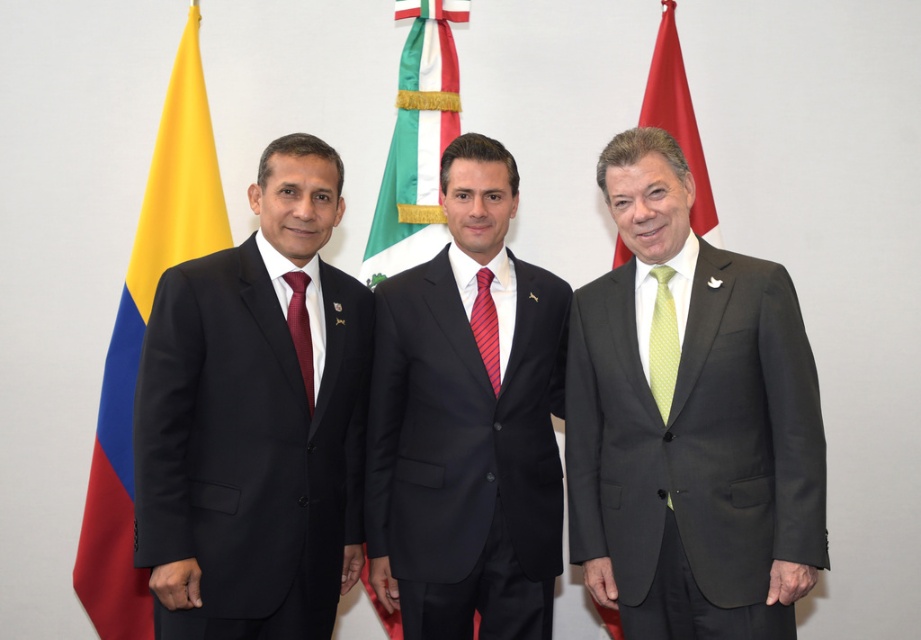
Question: Can you confirm if matte gray suit at right is positioned to the right of black suit at center?

Choices:
 (A) no
 (B) yes

Answer: (B)

Question: Where is matte gray suit at right located in relation to red fabric flag at right in the image?

Choices:
 (A) right
 (B) left

Answer: (B)

Question: Among these objects, which one is nearest to the camera?

Choices:
 (A) black suit at center
 (B) matte black suit at left
 (C) matte red tie at left
 (D) red striped tie at center

Answer: (B)

Question: Can you confirm if red striped tie at center is positioned above matte red tie at left?

Choices:
 (A) no
 (B) yes

Answer: (B)

Question: Which point is closer to the camera taking this photo?

Choices:
 (A) (391, 236)
 (B) (370, 534)
 (C) (668, 323)
 (D) (309, 348)

Answer: (C)

Question: Which point is farther to the camera?

Choices:
 (A) (309, 410)
 (B) (768, 502)
 (C) (656, 387)

Answer: (A)